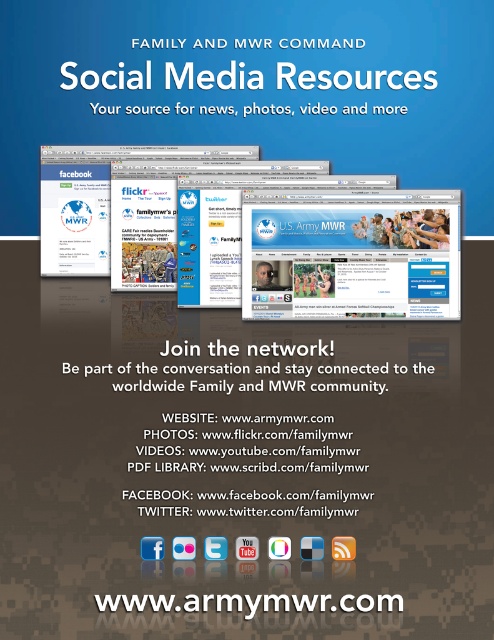
Does blue glossy computer screen at center appear on the right side of white text on brown website at bottom?

Indeed, blue glossy computer screen at center is positioned on the right side of white text on brown website at bottom.

At what (x,y) coordinates should I click in order to perform the action: click on blue glossy computer screen at center. Please return your answer as a coordinate pair (x, y). Looking at the image, I should click on (351, 253).

Locate an element on the screen. The height and width of the screenshot is (640, 494). blue glossy computer screen at center is located at coordinates (351, 253).

Is white paper at center behind blue glossy computer screen at center?

No, it is in front of blue glossy computer screen at center.

Which is behind, point (242, 376) or point (447, 252)?

The point (242, 376) is behind.

Does point (370, 349) come farther from viewer compared to point (363, 221)?

Yes, it is behind point (363, 221).

The image size is (494, 640). I want to click on white paper at center, so click(x=253, y=426).

Does white paper at center have a greater height compared to white text on brown website at bottom?

Correct, white paper at center is much taller as white text on brown website at bottom.

Can you confirm if white paper at center is positioned to the left of white text on brown website at bottom?

Incorrect, white paper at center is not on the left side of white text on brown website at bottom.

What do you see at coordinates (253, 426) in the screenshot? I see `white paper at center` at bounding box center [253, 426].

The height and width of the screenshot is (640, 494). I want to click on white paper at center, so click(x=253, y=426).